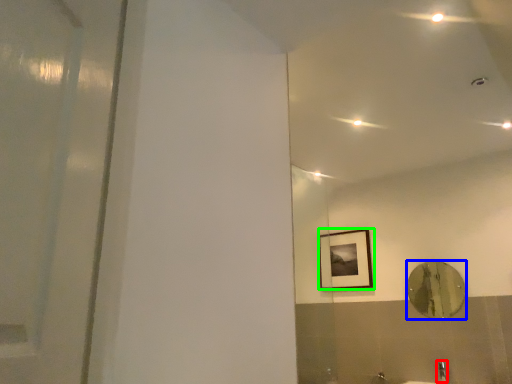
Question: Which is farther away from faucet (highlighted by a red box)? mirror (highlighted by a blue box) or picture frame (highlighted by a green box)?

Choices:
 (A) mirror
 (B) picture frame

Answer: (B)